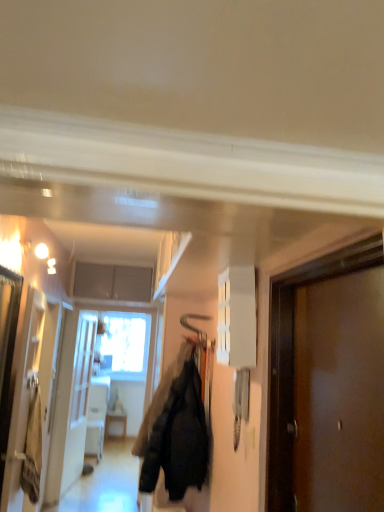
Question: Is velvet black jacket at center at the back of brown matte door at right?

Choices:
 (A) no
 (B) yes

Answer: (A)

Question: Does brown matte door at right have a larger size compared to velvet black jacket at center?

Choices:
 (A) yes
 (B) no

Answer: (B)

Question: Considering the relative sizes of brown matte door at right and velvet black jacket at center in the image provided, is brown matte door at right shorter than velvet black jacket at center?

Choices:
 (A) yes
 (B) no

Answer: (B)

Question: Could you tell me if brown matte door at right is turned towards velvet black jacket at center?

Choices:
 (A) no
 (B) yes

Answer: (A)

Question: From the image's perspective, would you say brown matte door at right is shown under velvet black jacket at center?

Choices:
 (A) no
 (B) yes

Answer: (A)

Question: Is white glossy cabinet at upper center wider or thinner than velvet black jacket at center?

Choices:
 (A) thin
 (B) wide

Answer: (A)

Question: Based on their sizes in the image, would you say white glossy cabinet at upper center is bigger or smaller than velvet black jacket at center?

Choices:
 (A) big
 (B) small

Answer: (B)

Question: In terms of height, does white glossy cabinet at upper center look taller or shorter compared to velvet black jacket at center?

Choices:
 (A) short
 (B) tall

Answer: (A)

Question: Which is correct: white glossy cabinet at upper center is inside velvet black jacket at center, or outside of it?

Choices:
 (A) inside
 (B) outside

Answer: (B)

Question: Considering the relative positions of brown matte door at right and velvet black jacket at center in the image provided, is brown matte door at right to the left or to the right of velvet black jacket at center?

Choices:
 (A) right
 (B) left

Answer: (A)

Question: Considering the positions of brown matte door at right and velvet black jacket at center in the image, is brown matte door at right taller or shorter than velvet black jacket at center?

Choices:
 (A) short
 (B) tall

Answer: (B)

Question: From a real-world perspective, is brown matte door at right physically located above or below velvet black jacket at center?

Choices:
 (A) below
 (B) above

Answer: (B)

Question: In terms of size, does brown matte door at right appear bigger or smaller than velvet black jacket at center?

Choices:
 (A) big
 (B) small

Answer: (B)

Question: Based on their positions, is velvet black jacket at center located to the left or right of brown matte door at right?

Choices:
 (A) left
 (B) right

Answer: (A)

Question: From a real-world perspective, is velvet black jacket at center positioned above or below brown matte door at right?

Choices:
 (A) below
 (B) above

Answer: (A)